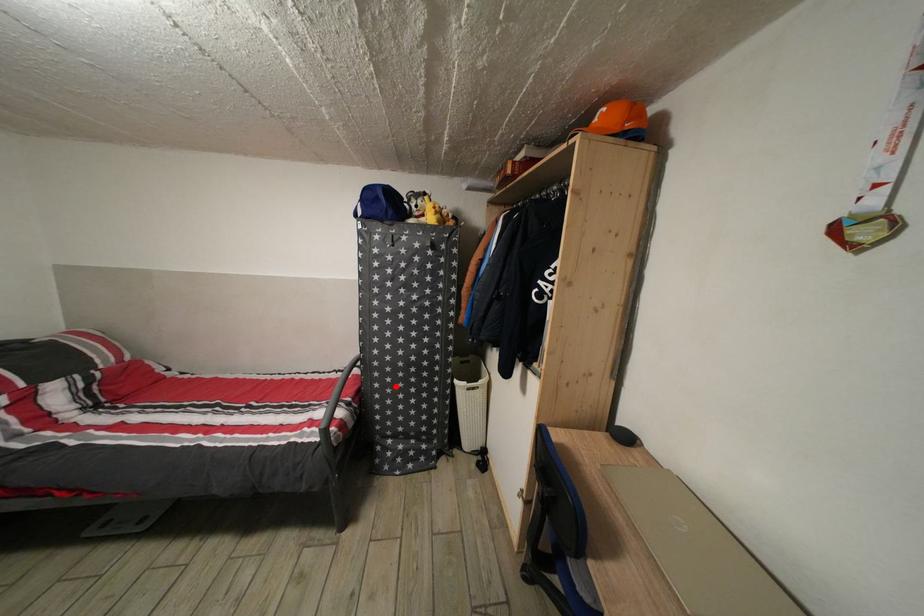
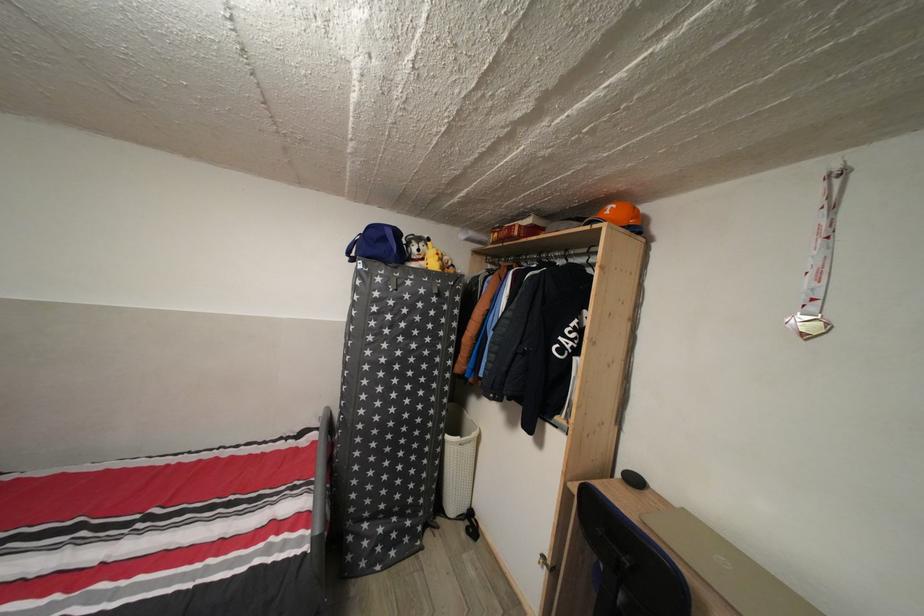
The point at the highlighted location is marked in the first image. Where is the corresponding point in the second image?

(380, 451)